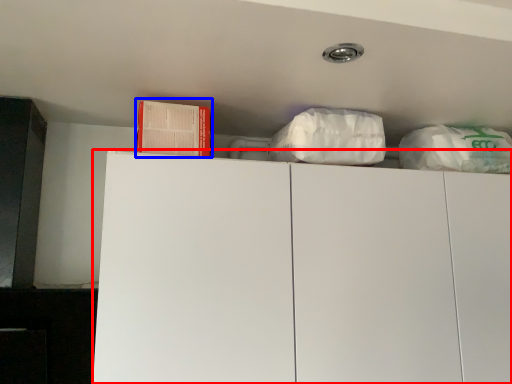
Question: Which point is further to the camera, cabinetry (highlighted by a red box) or book (highlighted by a blue box)?

Choices:
 (A) cabinetry
 (B) book

Answer: (B)